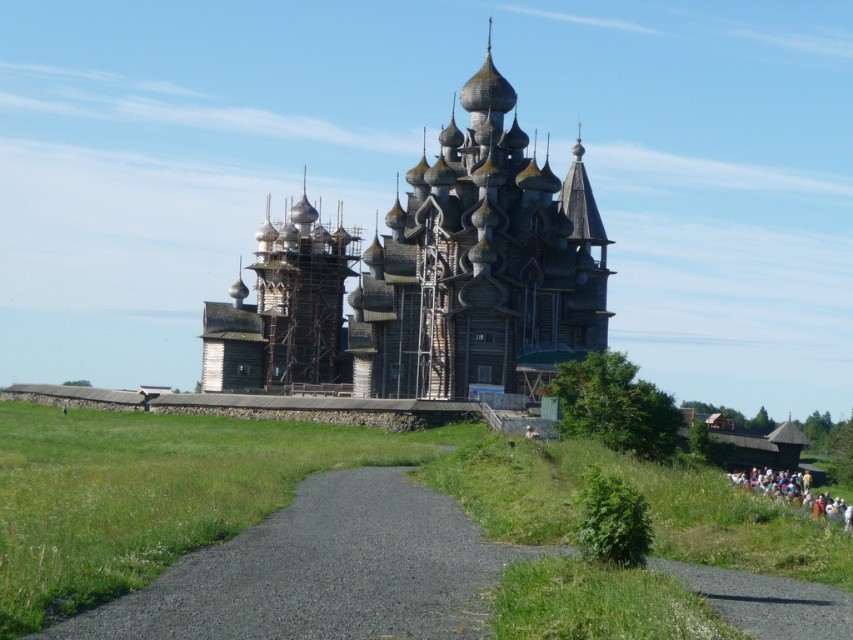
Question: Can you confirm if wooden church at center is positioned below white cotton crowd at lower right?

Choices:
 (A) yes
 (B) no

Answer: (B)

Question: Among these points, which one is farthest from the camera?

Choices:
 (A) (450, 340)
 (B) (801, 483)

Answer: (B)

Question: Where is wooden church at center located in relation to white cotton crowd at lower right in the image?

Choices:
 (A) above
 (B) below

Answer: (A)

Question: Does wooden church at center have a larger size compared to white cotton crowd at lower right?

Choices:
 (A) yes
 (B) no

Answer: (A)

Question: Which point is closer to the camera?

Choices:
 (A) white cotton crowd at lower right
 (B) wooden church at center

Answer: (A)